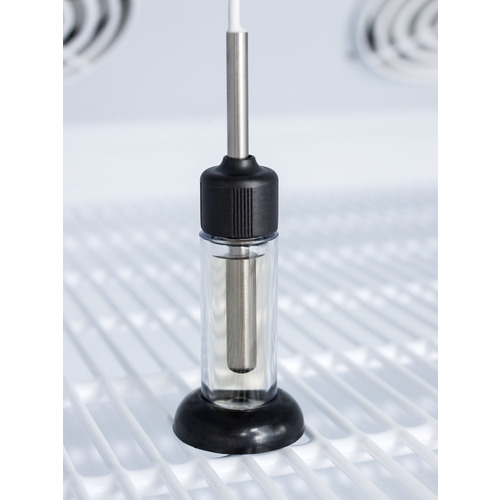
Find the location of a particular element. Image resolution: width=500 pixels, height=500 pixels. burner is located at coordinates (407, 46).